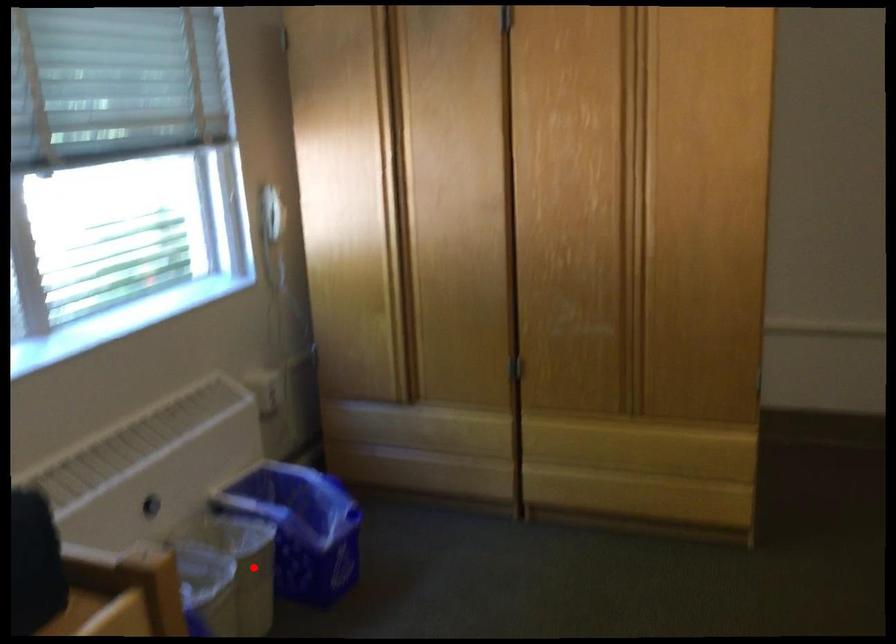
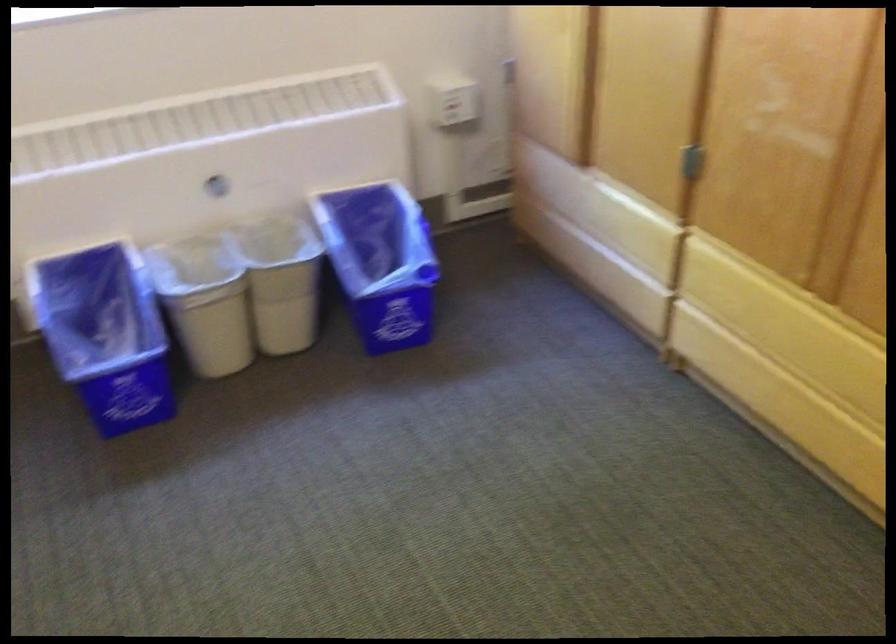
Locate, in the second image, the point that corresponds to the highlighted location in the first image.

(281, 281)